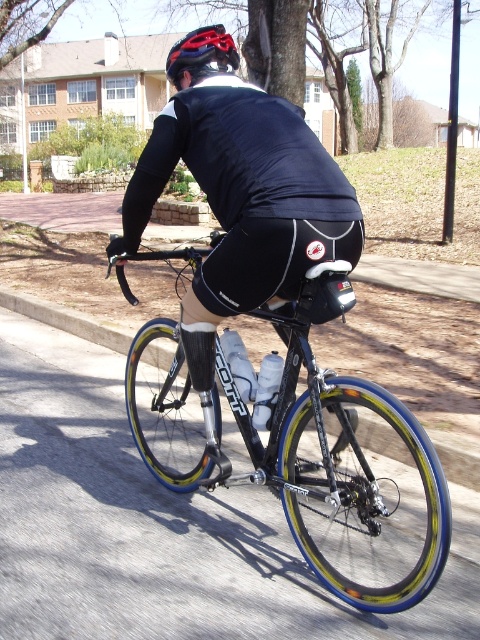
You are a pedestrian standing on the sidewalk and see the black matte bicycle at center and the matte black helmet at upper center. Which object is higher from the ground?

The matte black helmet at upper center is higher from the ground than the black matte bicycle at center because it is positioned above it.

You are a delivery person who needs to place a small package on the ground near the black matte bicycle at center. The package must be placed exactly at point (302, 449). Can you confirm if the black matte bicycle at center is located at that coordinate?

Yes, the black matte bicycle at center is located at point (302, 449).